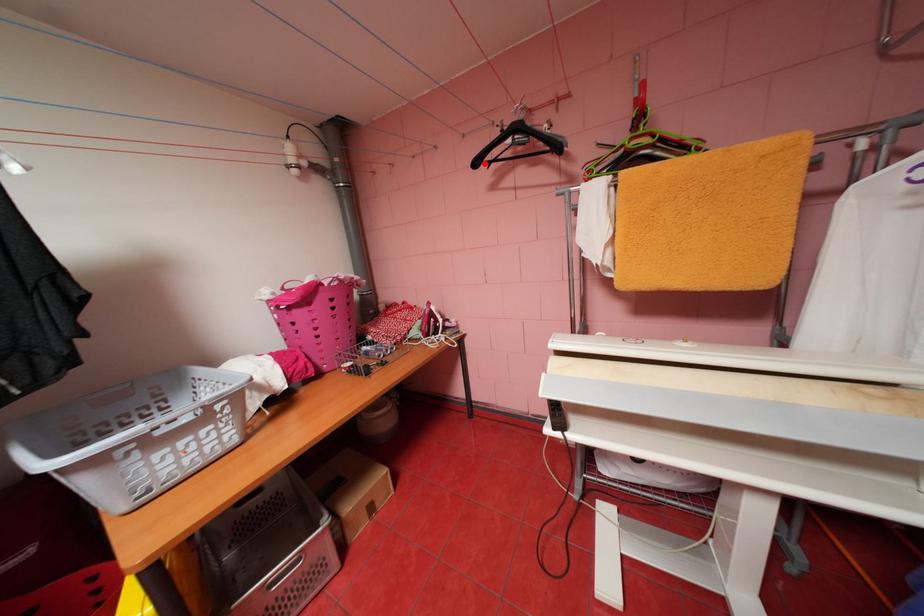
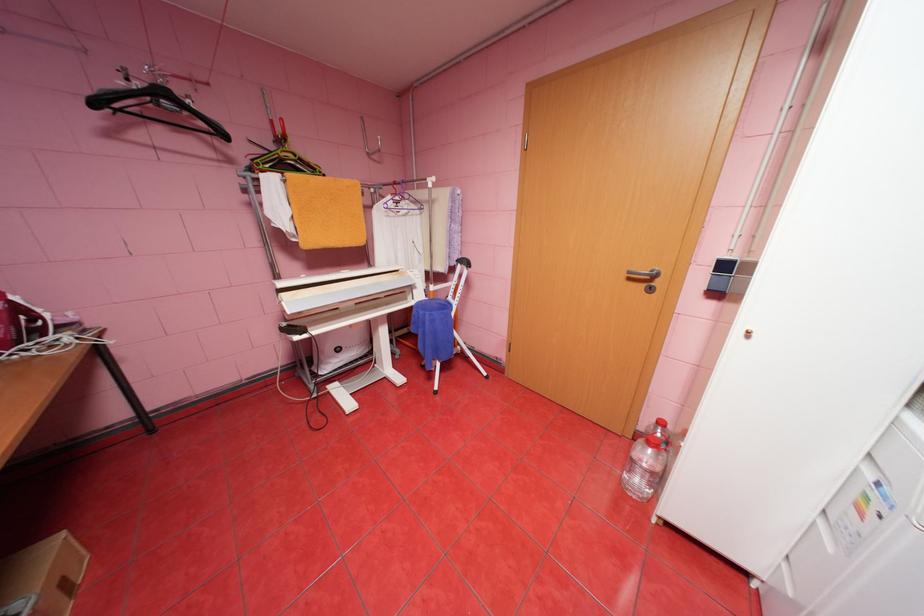
Question: I am providing you with two images of the same scene from different viewpoints. A red point is marked on the first image. Can you still see the location of the red point in image 2?

Choices:
 (A) Yes
 (B) No

Answer: (A)